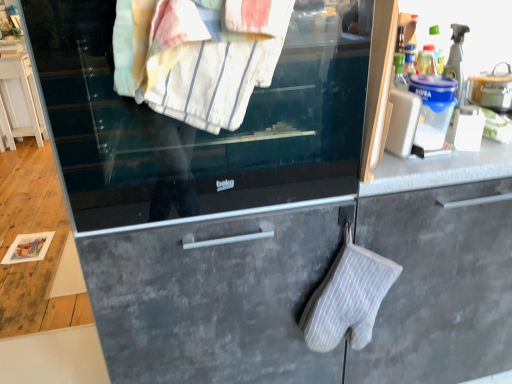
Question: Considering the relative sizes of clear glass oven door at center and white plastic phone at upper right in the image provided, is clear glass oven door at center bigger than white plastic phone at upper right?

Choices:
 (A) no
 (B) yes

Answer: (B)

Question: Considering the relative positions of clear glass oven door at center and white plastic phone at upper right in the image provided, is clear glass oven door at center to the right of white plastic phone at upper right from the viewer's perspective?

Choices:
 (A) no
 (B) yes

Answer: (A)

Question: Is clear glass oven door at center with white plastic phone at upper right?

Choices:
 (A) yes
 (B) no

Answer: (B)

Question: From a real-world perspective, is clear glass oven door at center positioned over white plastic phone at upper right based on gravity?

Choices:
 (A) no
 (B) yes

Answer: (B)

Question: Is clear glass oven door at center looking in the opposite direction of white plastic phone at upper right?

Choices:
 (A) no
 (B) yes

Answer: (A)

Question: Considering their positions, is white glossy cabinet at left located in front of or behind clear glass oven door at center?

Choices:
 (A) front
 (B) behind

Answer: (B)

Question: Is white glossy cabinet at left bigger or smaller than clear glass oven door at center?

Choices:
 (A) big
 (B) small

Answer: (B)

Question: Is white glossy cabinet at left situated inside clear glass oven door at center or outside?

Choices:
 (A) outside
 (B) inside

Answer: (A)

Question: Is white glossy cabinet at left to the left or to the right of clear glass oven door at center in the image?

Choices:
 (A) right
 (B) left

Answer: (B)

Question: Considering their positions, is white striped towel at upper center located in front of or behind white plastic phone at upper right?

Choices:
 (A) behind
 (B) front

Answer: (B)

Question: In terms of width, does white striped towel at upper center look wider or thinner when compared to white plastic phone at upper right?

Choices:
 (A) wide
 (B) thin

Answer: (A)

Question: In the image, is white striped towel at upper center on the left side or the right side of white plastic phone at upper right?

Choices:
 (A) right
 (B) left

Answer: (B)

Question: In terms of height, does white striped towel at upper center look taller or shorter compared to white plastic phone at upper right?

Choices:
 (A) short
 (B) tall

Answer: (B)

Question: Based on their positions, is clear glass oven door at center located to the left or right of white striped oven mitt at lower center?

Choices:
 (A) right
 (B) left

Answer: (B)

Question: From a real-world perspective, relative to white striped oven mitt at lower center, is clear glass oven door at center vertically above or below?

Choices:
 (A) above
 (B) below

Answer: (A)